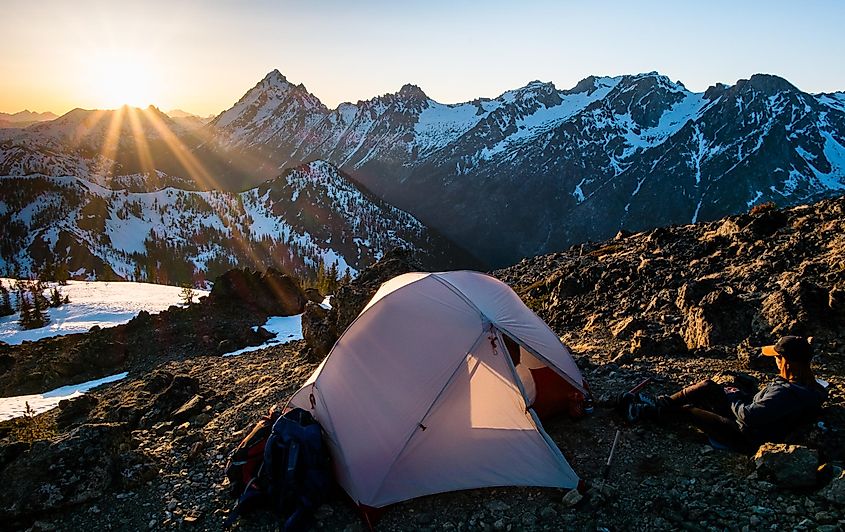
The image size is (845, 532). I want to click on place to sleep, so click(540, 409).